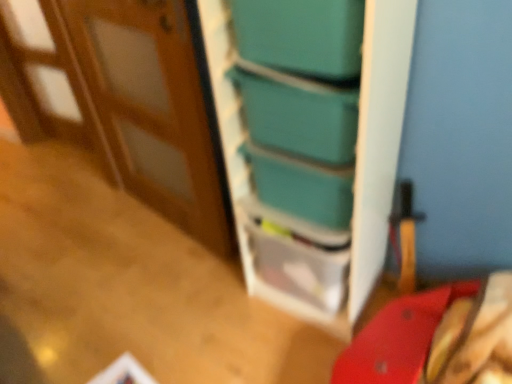
Question: Is teal plastic bookshelf at center to the left or to the right of teal plastic drawer at center in the image?

Choices:
 (A) left
 (B) right

Answer: (A)

Question: From the image's perspective, is teal plastic bookshelf at center above or below teal plastic drawer at center?

Choices:
 (A) below
 (B) above

Answer: (B)

Question: Estimate the real-world distances between objects in this image. Which object is closer to the teal plastic bookshelf at center?

Choices:
 (A) wooden at left
 (B) teal plastic box at upper center, which is the 1th box in top-to-bottom order
 (C) smooth red table at lower right
 (D) teal plastic drawer at center
 (E) teal plastic box at center, placed as the first box when sorted from bottom to top

Answer: (E)

Question: Estimate the real-world distances between objects in this image. Which object is farther from the teal plastic box at center, placed as the first box when sorted from bottom to top?

Choices:
 (A) teal plastic drawer at center
 (B) wooden at left
 (C) smooth red table at lower right
 (D) teal plastic bookshelf at center
 (E) teal plastic box at upper center, which is the 1th box in top-to-bottom order

Answer: (C)